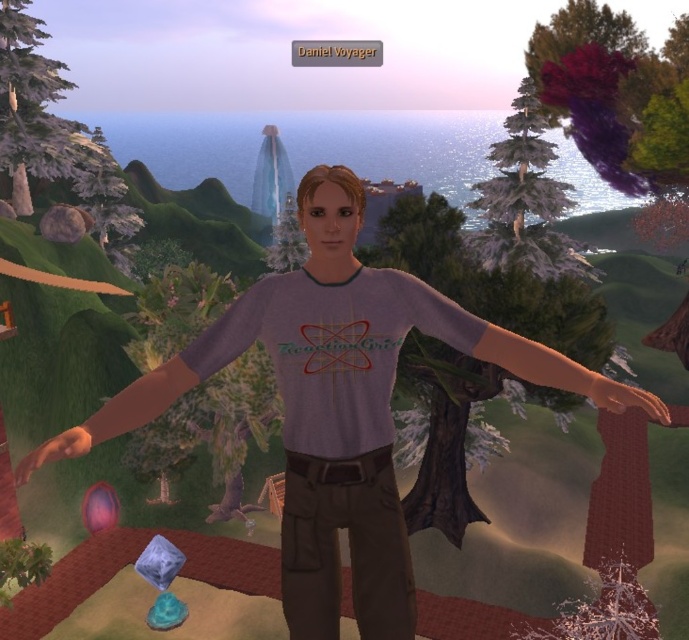
Question: Is green matte tree at upper left closer to camera compared to green matte tree at center?

Choices:
 (A) yes
 (B) no

Answer: (B)

Question: Can you confirm if matte gray shirt at center is smaller than green matte tree at upper left?

Choices:
 (A) yes
 (B) no

Answer: (A)

Question: Observing the image, what is the correct spatial positioning of green matte tree at upper left in reference to green matte tree at center?

Choices:
 (A) right
 (B) left

Answer: (B)

Question: Which point appears farthest from the camera in this image?

Choices:
 (A) (376, 586)
 (B) (584, 627)
 (C) (285, 268)
 (D) (23, 163)

Answer: (C)

Question: Which object appears farthest from the camera in this image?

Choices:
 (A) green matte tree at center
 (B) green matte tree at left
 (C) green matte tree at upper left
 (D) snowy bark tree at lower right

Answer: (C)

Question: Estimate the real-world distances between objects in this image. Which object is closer to the green matte tree at center?

Choices:
 (A) green matte tree at left
 (B) matte gray shirt at center
 (C) snowy bark tree at lower right
 (D) green matte tree at upper left

Answer: (D)